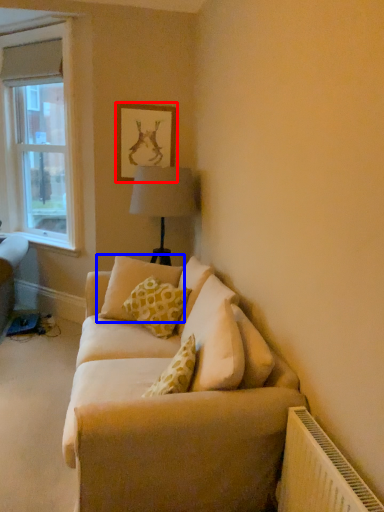
Question: Among these objects, which one is nearest to the camera, picture frame (highlighted by a red box) or pillow (highlighted by a blue box)?

Choices:
 (A) picture frame
 (B) pillow

Answer: (B)